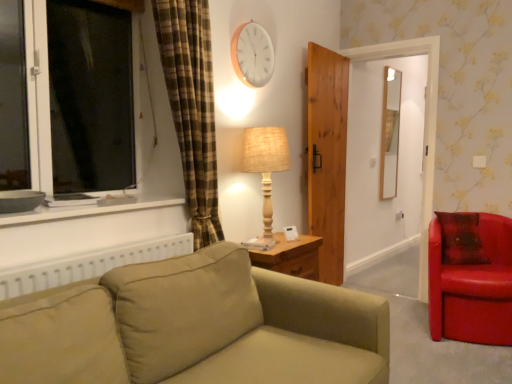
Question: Would you say shiny leather armchair at right is to the left or to the right of woven beige lamp at center in the picture?

Choices:
 (A) left
 (B) right

Answer: (B)

Question: From a real-world perspective, is shiny leather armchair at right physically located above or below woven beige lamp at center?

Choices:
 (A) above
 (B) below

Answer: (B)

Question: Considering the real-world distances, which object is closest to the matte gray bowl at left?

Choices:
 (A) wooden clock at upper center
 (B) matte beige couch at center
 (C) wooden door at center
 (D) matte wooden mirror at upper right
 (E) shiny leather armchair at right

Answer: (B)

Question: Estimate the real-world distances between objects in this image. Which object is closer to the wooden clock at upper center?

Choices:
 (A) wooden door at center
 (B) woven beige lamp at center
 (C) shiny leather armchair at right
 (D) matte wooden mirror at upper right
 (E) matte gray bowl at left

Answer: (B)